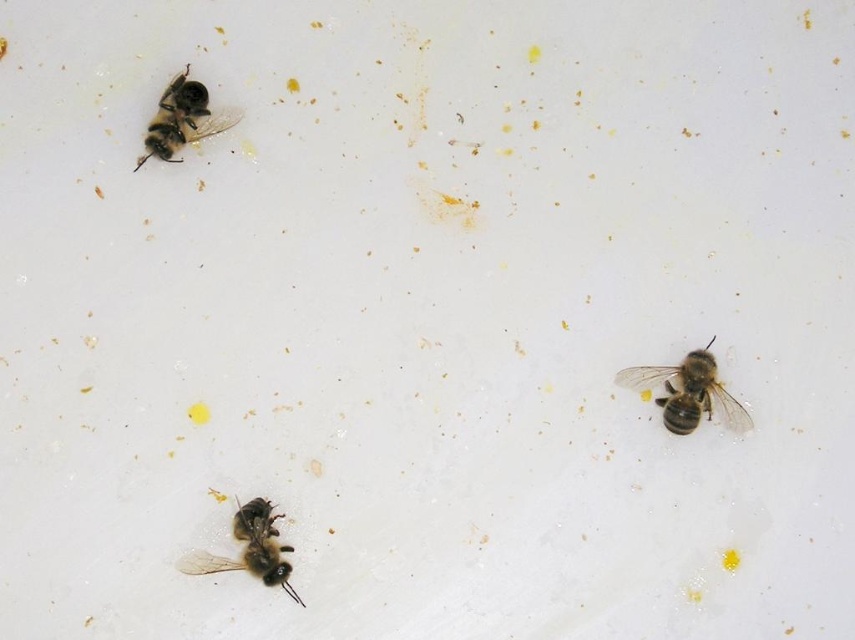
Between brown fuzzy bee at right and brown fuzzy bee at upper left, which one is positioned higher?

Positioned higher is brown fuzzy bee at upper left.

Where is `brown fuzzy bee at right`? This screenshot has height=640, width=855. brown fuzzy bee at right is located at coordinates (x=688, y=392).

Does point (677, 400) come farther from viewer compared to point (208, 120)?

Yes.

Image resolution: width=855 pixels, height=640 pixels. Find the location of `brown fuzzy bee at right`. brown fuzzy bee at right is located at coordinates (688, 392).

Between brown fuzzy bee at right and black fuzzy bee at lower left, which one has less height?

brown fuzzy bee at right

Between brown fuzzy bee at right and black fuzzy bee at lower left, which one is positioned higher?

brown fuzzy bee at right is higher up.

Find the location of `brown fuzzy bee at right`. brown fuzzy bee at right is located at coordinates (688, 392).

Is black fuzzy bee at lower left below brown fuzzy bee at upper left?

Yes, black fuzzy bee at lower left is below brown fuzzy bee at upper left.

From the picture: Does black fuzzy bee at lower left appear on the left side of brown fuzzy bee at upper left?

No, black fuzzy bee at lower left is not to the left of brown fuzzy bee at upper left.

You are a GUI agent. You are given a task and a screenshot of the screen. Output one action in this format:
    pyautogui.click(x=<x>, y=<y>)
    Task: Click on the black fuzzy bee at lower left
    The height and width of the screenshot is (640, 855).
    Given the screenshot: What is the action you would take?
    pyautogui.click(x=251, y=548)

Image resolution: width=855 pixels, height=640 pixels. Identify the location of black fuzzy bee at lower left. [x=251, y=548].